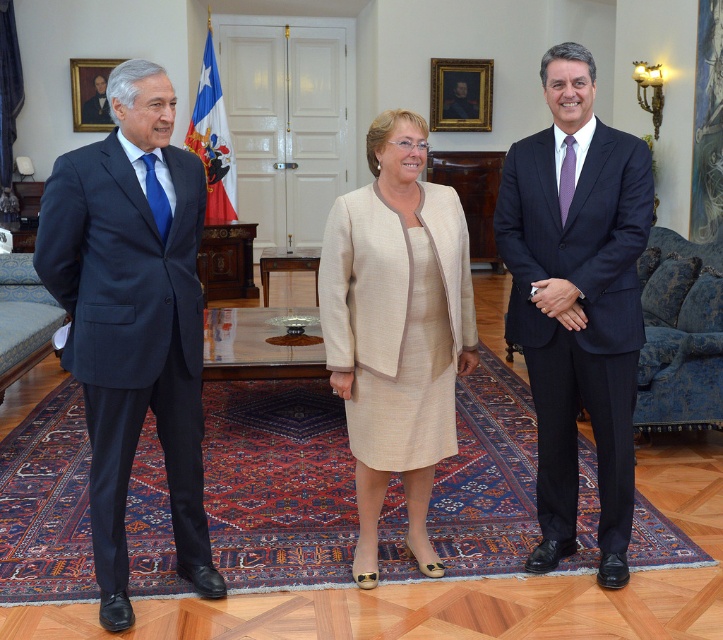
You are an event planner arranging a photoshoot in this room. You need to position a large backdrop to the right of both the matte black suit at left and the beige textured suit at center. Based on their current positions, which person should you place the backdrop to the right of?

The backdrop should be placed to the right of the beige textured suit at center because the matte black suit at left is positioned to the left of the beige textured suit at center, making the beige textured suit the furthest to the right between the two.

You are standing in the room and want to place a small object at point [132,317]. Which person is closest to that point?

The point [132,317] is on the matte black suit at left, so the person on the left is closest to that point.